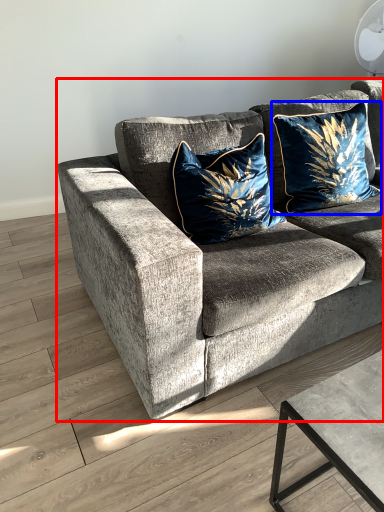
Question: Which point is closer to the camera, studio couch (highlighted by a red box) or pillow (highlighted by a blue box)?

Choices:
 (A) studio couch
 (B) pillow

Answer: (A)